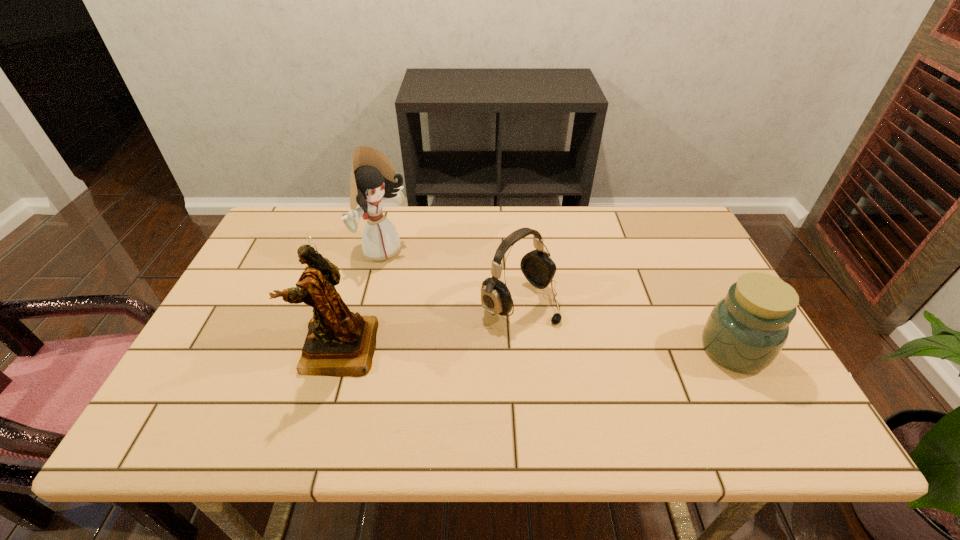
In order to click on free spot between the doll and the rightmost object in this screenshot , I will do (x=559, y=300).

Image resolution: width=960 pixels, height=540 pixels. What are the coordinates of `empty location between the jar and the doll` in the screenshot? It's located at (559, 300).

Where is `empty space between the farthest object and the jar`? Image resolution: width=960 pixels, height=540 pixels. empty space between the farthest object and the jar is located at coordinates (559, 300).

This screenshot has height=540, width=960. What are the coordinates of `free space that is in between the rightmost object and the third object from left to right` in the screenshot? It's located at (627, 326).

The width and height of the screenshot is (960, 540). I want to click on object that is the nearest to the doll, so click(x=340, y=343).

The width and height of the screenshot is (960, 540). I want to click on the second closest object relative to the jar, so click(x=373, y=179).